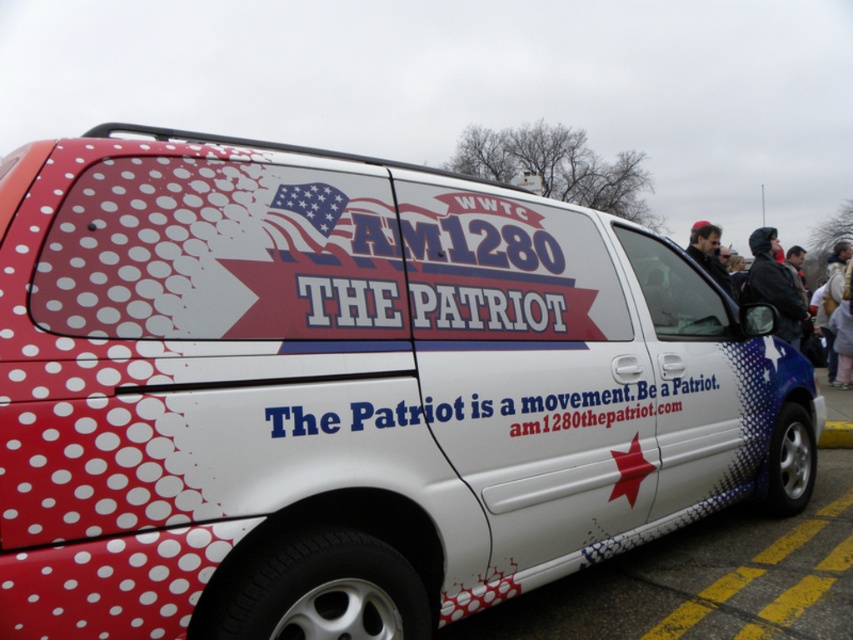
Where is the white glossy van at lower right located in the image?

The white glossy van at lower right is located at point (683, 573).

What is the color of the jacket located at point [755,276] on the right side of the van?

The dark blue jacket at right is represented by point [755,276], so the color is dark blue.

You are a graphic designer tasked with creating a new logo for the van. The client wants the new logo to be as wide as the dark blue jacket at right. Given the current white vinyl text at center, which is thinner than the jacket, what adjustment should you make to the logo design?

The white vinyl text at center is thinner than the dark blue jacket at right, so to make the new logo as wide as the jacket, you should increase the width of the white vinyl text at center to match the width of the dark blue jacket at right.